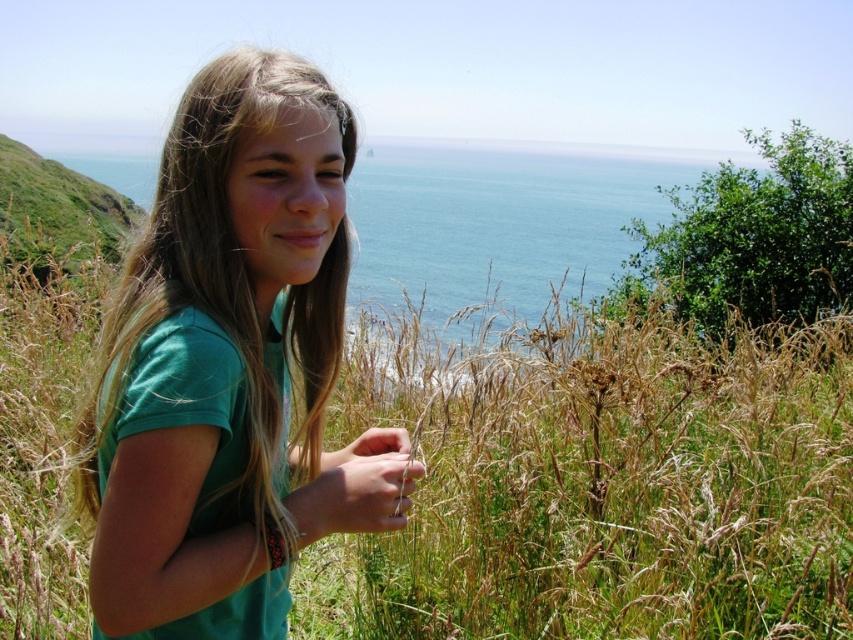
You are standing at the origin point of the image coordinate system and looking towards the girl. Which point, point (151, 308) or point (764, 184), is closer to you?

Point (151, 308) is closer to you because it is in front of point (764, 184).

You are a photographer planning to capture the girl in the scene. To ensure the blue water at upper center is visible in the background, should you focus on the dry grass at center or the girl?

The dry grass at center is not as tall as the blue water at upper center, so focusing on the girl will keep her in the foreground while allowing the blue water at upper center to remain visible in the background.

You are a photographer trying to capture the girl in the scene. The green matte shirt at center and the green leafy plant at upper right are both in your viewfinder. Which object is positioned higher in the frame?

The green leafy plant at upper right is positioned higher in the frame than the green matte shirt at center, as the green matte shirt at center is located below it.